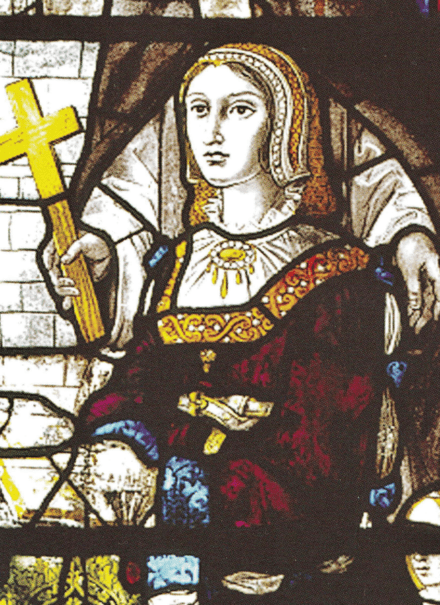
Find the location of `wooden base of gold cross, left side`. wooden base of gold cross, left side is located at coordinates (84, 308).